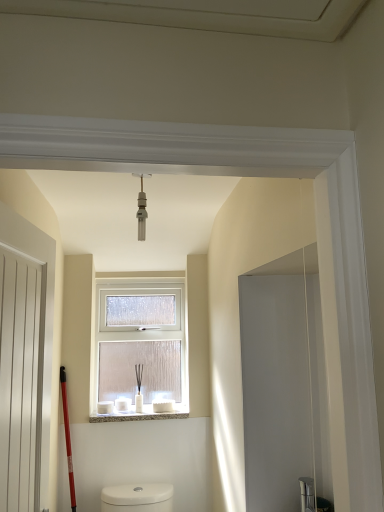
From the picture: Measure the distance between clear frosted glass window at center and camera.

The depth of clear frosted glass window at center is 7.96 feet.

Image resolution: width=384 pixels, height=512 pixels. What are the coordinates of `matte silver light fixture at center` in the screenshot? It's located at (142, 210).

Describe the element at coordinates (21, 379) in the screenshot. The image size is (384, 512). I see `white wooden screen door at left` at that location.

Identify the location of clear frosted glass window at center. The width and height of the screenshot is (384, 512). (140, 349).

Considering the sizes of objects matte silver light fixture at center and clear frosted glass window at center in the image provided, who is thinner, matte silver light fixture at center or clear frosted glass window at center?

matte silver light fixture at center.

Looking at this image, are matte silver light fixture at center and clear frosted glass window at center beside each other?

No, matte silver light fixture at center is not with clear frosted glass window at center.

From a real-world perspective, is matte silver light fixture at center positioned under clear frosted glass window at center based on gravity?

No, from a real-world perspective, matte silver light fixture at center is not under clear frosted glass window at center.

Measure the distance from clear frosted glass window at center to white wooden screen door at left.

A: clear frosted glass window at center and white wooden screen door at left are 4.37 feet apart.

Does clear frosted glass window at center have a lesser width compared to white wooden screen door at left?

No, clear frosted glass window at center is not thinner than white wooden screen door at left.

Does point (163, 311) come closer to viewer compared to point (0, 358)?

That is False.

Find the location of a particular element. screen door on the left of clear frosted glass window at center is located at coordinates (21, 379).

Does white textured stone at center have a smaller size compared to matte silver light fixture at center?

No.

From the image's perspective, is white textured stone at center below matte silver light fixture at center?

Yes, from the image's perspective, white textured stone at center is beneath matte silver light fixture at center.

Which of these two, white textured stone at center or matte silver light fixture at center, stands taller?

Standing taller between the two is matte silver light fixture at center.

Is clear frosted glass window at center positioned with its back to white textured stone at center?

No, clear frosted glass window at center's orientation is not away from white textured stone at center.

Is clear frosted glass window at center far from white textured stone at center?

No, clear frosted glass window at center is not far from white textured stone at center.

Looking at their sizes, would you say clear frosted glass window at center is wider or thinner than white textured stone at center?

Clearly, clear frosted glass window at center has less width compared to white textured stone at center.

In the scene shown: Considering the relative positions of clear frosted glass window at center and white textured stone at center in the image provided, is clear frosted glass window at center behind white textured stone at center?

That is True.

Can you confirm if clear frosted glass window at center is positioned to the left of matte silver light fixture at center?

Correct, you'll find clear frosted glass window at center to the left of matte silver light fixture at center.

Considering the sizes of objects clear frosted glass window at center and matte silver light fixture at center in the image provided, who is taller, clear frosted glass window at center or matte silver light fixture at center?

Standing taller between the two is clear frosted glass window at center.

How distant is clear frosted glass window at center from matte silver light fixture at center?

A distance of 1.17 meters exists between clear frosted glass window at center and matte silver light fixture at center.

From the picture: How different are the orientations of clear frosted glass window at center and matte silver light fixture at center in degrees?

clear frosted glass window at center and matte silver light fixture at center are facing 0.115 degrees away from each other.

Can you tell me how much white wooden screen door at left and white textured stone at center differ in facing direction?

There is a 88.6-degree angle between the facing directions of white wooden screen door at left and white textured stone at center.

Which object is positioned more to the left, white wooden screen door at left or white textured stone at center?

white wooden screen door at left.

Considering the relative sizes of white wooden screen door at left and white textured stone at center in the image provided, is white wooden screen door at left shorter than white textured stone at center?

Incorrect, the height of white wooden screen door at left does not fall short of that of white textured stone at center.

Considering the relative sizes of white wooden screen door at left and white textured stone at center in the image provided, is white wooden screen door at left wider than white textured stone at center?

Incorrect, the width of white wooden screen door at left does not surpass that of white textured stone at center.

From the picture: From the image's perspective, does matte silver light fixture at center appear lower than white textured stone at center?

No, from the image's perspective, matte silver light fixture at center is not beneath white textured stone at center.

In the image, is matte silver light fixture at center positioned in front of or behind white textured stone at center?

In the image, matte silver light fixture at center appears in front of white textured stone at center.

Who is bigger, matte silver light fixture at center or white textured stone at center?

Bigger between the two is white textured stone at center.

Would you consider matte silver light fixture at center to be distant from white textured stone at center?

Yes, matte silver light fixture at center and white textured stone at center are quite far apart.

Where is `light fixture above the clear frosted glass window at center (from a real-world perspective)`? This screenshot has width=384, height=512. light fixture above the clear frosted glass window at center (from a real-world perspective) is located at coordinates (142, 210).

Where is `window located behind the white wooden screen door at left`? This screenshot has width=384, height=512. window located behind the white wooden screen door at left is located at coordinates (140, 349).

Considering their positions, is matte silver light fixture at center positioned closer to white wooden screen door at left than clear frosted glass window at center?

matte silver light fixture at center is closer to white wooden screen door at left.

Considering their positions, is white wooden screen door at left positioned further to clear frosted glass window at center than matte silver light fixture at center?

white wooden screen door at left is positioned further to the anchor clear frosted glass window at center.

From the picture: Considering their positions, is white textured stone at center positioned further to clear frosted glass window at center than matte silver light fixture at center?

matte silver light fixture at center.

Consider the image. Which object lies further to the anchor point matte silver light fixture at center, white textured stone at center or white wooden screen door at left?

white textured stone at center lies further to matte silver light fixture at center than the other object.

Estimate the real-world distances between objects in this image. Which object is closer to white wooden screen door at left, white textured stone at center or clear frosted glass window at center?

white textured stone at center.

When comparing their distances from white textured stone at center, does matte silver light fixture at center or white wooden screen door at left seem closer?

matte silver light fixture at center is positioned closer to the anchor white textured stone at center.

Based on the photo, estimate the real-world distances between objects in this image. Which object is further from clear frosted glass window at center, matte silver light fixture at center or white wooden screen door at left?

Based on the image, white wooden screen door at left appears to be further to clear frosted glass window at center.

Considering their positions, is white wooden screen door at left positioned closer to white textured stone at center than matte silver light fixture at center?

matte silver light fixture at center is closer to white textured stone at center.

Locate an element on the screen. window between matte silver light fixture at center and white textured stone at center vertically is located at coordinates coord(140,349).

At what (x,y) coordinates should I click in order to perform the action: click on light fixture located between white wooden screen door at left and clear frosted glass window at center in the depth direction. Please return your answer as a coordinate pair (x, y). Looking at the image, I should click on (142, 210).

At what (x,y) coordinates should I click in order to perform the action: click on light fixture positioned between white wooden screen door at left and white textured stone at center from near to far. Please return your answer as a coordinate pair (x, y). The image size is (384, 512). Looking at the image, I should click on (142, 210).

Identify the location of window sill between white wooden screen door at left and clear frosted glass window at center from front to back. (140, 414).